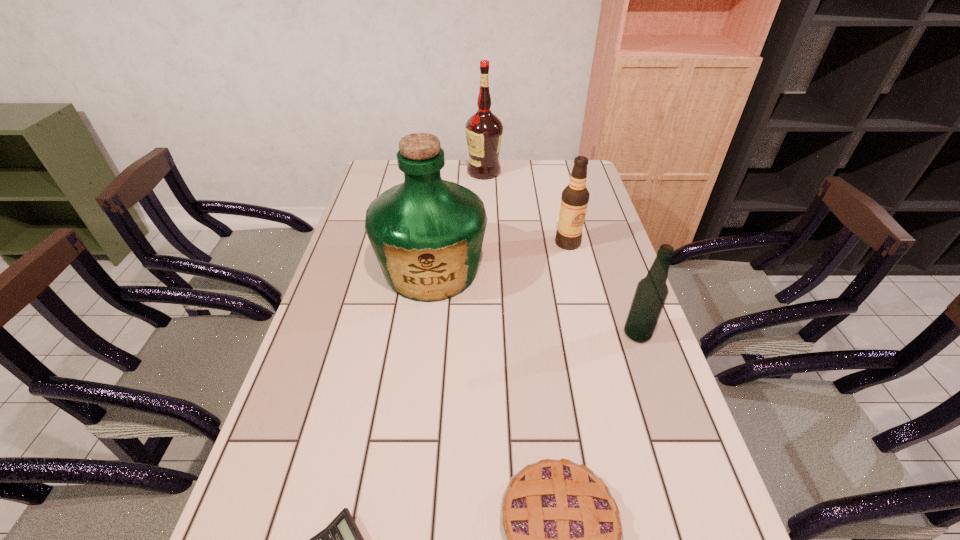
Identify the location of the farthest object. This screenshot has width=960, height=540. (484, 130).

This screenshot has width=960, height=540. In order to click on the leftmost alcohol in this screenshot , I will do `click(484, 130)`.

Where is `liquor`? This screenshot has height=540, width=960. liquor is located at coordinates (427, 233).

This screenshot has width=960, height=540. Find the location of `the second farthest alcohol`. the second farthest alcohol is located at coordinates (574, 201).

Locate an element on the screen. the fourth farthest object is located at coordinates (651, 293).

This screenshot has width=960, height=540. In order to click on the rightmost object in this screenshot , I will do pyautogui.click(x=651, y=293).

Identify the location of blank space located on the label of the leftmost alcohol. (439, 172).

Identify the location of vacant region located 0.120m on the label of the leftmost alcohol. The image size is (960, 540). (436, 172).

The width and height of the screenshot is (960, 540). I want to click on free space located on the label of the leftmost alcohol, so pos(419,172).

At what (x,y) coordinates should I click in order to perform the action: click on free spot located on the label side of the liquor. Please return your answer as a coordinate pair (x, y). Looking at the image, I should click on (x=416, y=397).